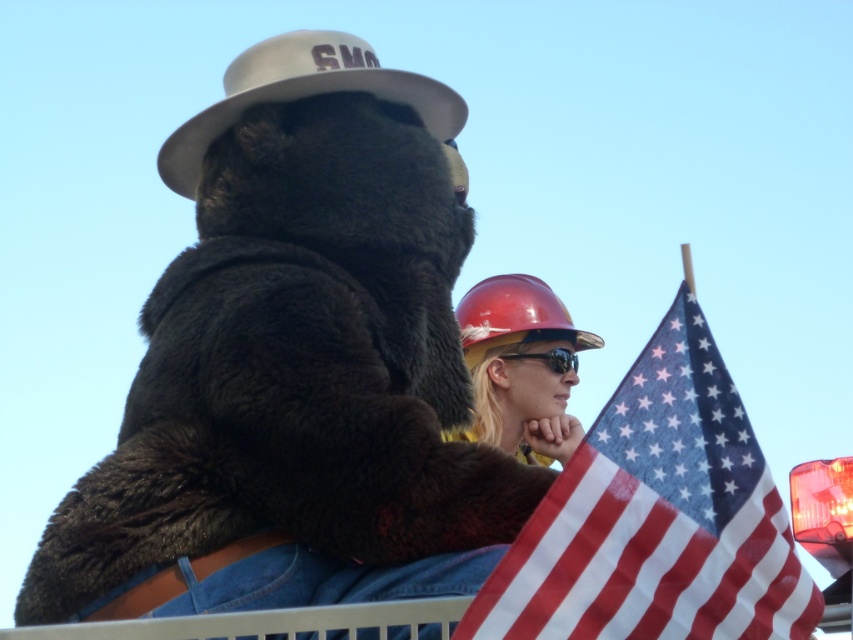
You are an observer looking at the scene. Which object is positioned higher up between the shiny red hard hat at center and the white matte hat at upper center?

The white matte hat at upper center is positioned higher up than the shiny red hard hat at center.

What is located at the coordinates point (296, 365) in the image?

The point (296, 365) is on the hard hat at upper center.

Where is the hard hat at upper center located in the image?

The hard hat at upper center is located at point (296, 365) in the image.